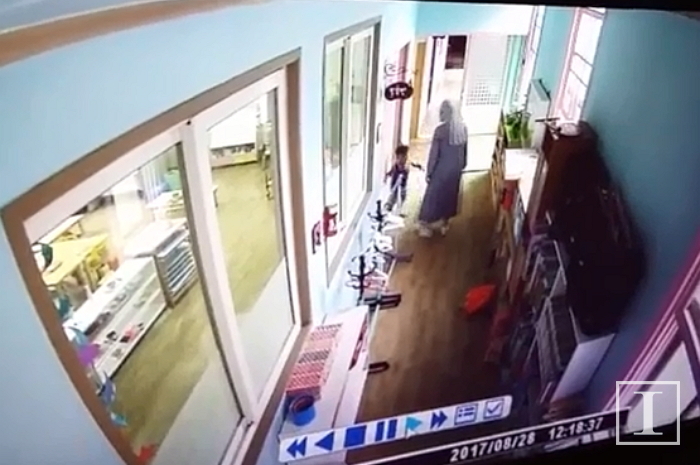
Image resolution: width=700 pixels, height=465 pixels. I want to click on shelf, so (x=542, y=356), (x=526, y=288), (x=125, y=312), (x=171, y=254), (x=70, y=274), (x=229, y=151), (x=498, y=166), (x=514, y=214).